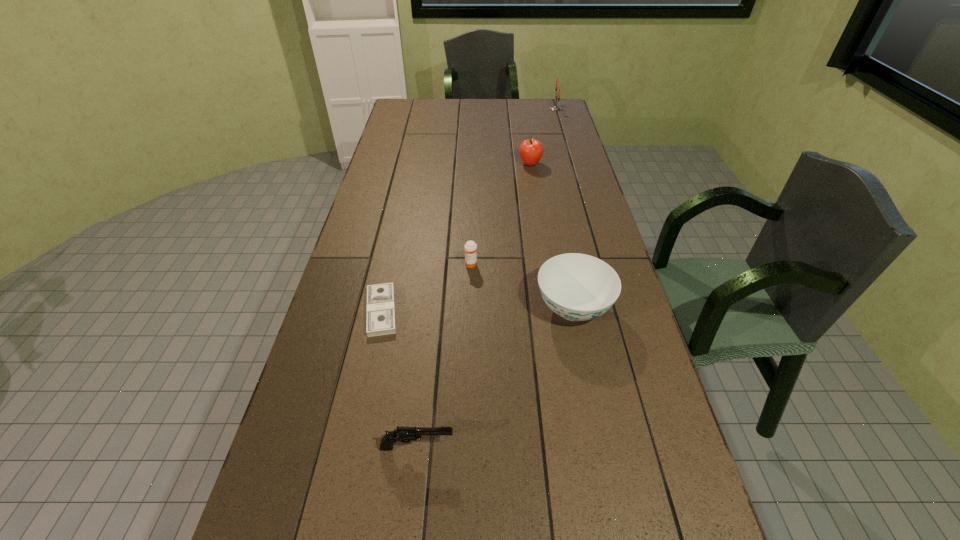
The width and height of the screenshot is (960, 540). I want to click on vacant space located on the front-facing side of the candle, so click(475, 109).

At what (x,y) coordinates should I click in order to perform the action: click on free space located on the front-facing side of the candle. Please return your answer as a coordinate pair (x, y). Looking at the image, I should click on (488, 109).

Identify the location of blank space located 0.230m on the front of the second farthest object. (537, 203).

The height and width of the screenshot is (540, 960). Find the location of `vacant space situated 0.270m on the left of the chinaware`. vacant space situated 0.270m on the left of the chinaware is located at coordinates (439, 308).

Image resolution: width=960 pixels, height=540 pixels. In order to click on free space located 0.150m at the end of the barrel of the gun in this screenshot , I will do `click(523, 447)`.

This screenshot has width=960, height=540. In order to click on vacant space located 0.060m on the front of the third object from left to right in this screenshot , I will do `click(470, 283)`.

Where is `vacant region located 0.310m on the back of the shortest object`? The image size is (960, 540). vacant region located 0.310m on the back of the shortest object is located at coordinates (400, 223).

This screenshot has width=960, height=540. What are the coordinates of `object present at the far edge` in the screenshot? It's located at (554, 108).

At what (x,y) coordinates should I click in order to perform the action: click on object that is at the left edge. Please return your answer as a coordinate pair (x, y). The width and height of the screenshot is (960, 540). Looking at the image, I should click on (380, 320).

Locate an element on the screen. candle situated at the right edge is located at coordinates click(554, 108).